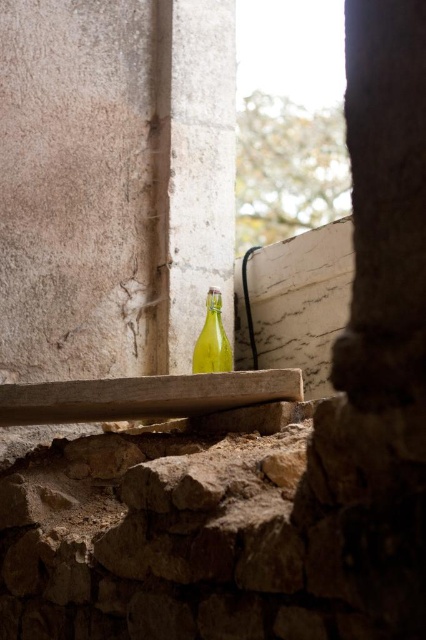
Which is below, smooth wooden plank at center or green glass bottle at center?

smooth wooden plank at center is below.

Is smooth wooden plank at center bigger than green glass bottle at center?

Correct, smooth wooden plank at center is larger in size than green glass bottle at center.

Between point (221, 404) and point (215, 332), which one is positioned in front?

Point (221, 404)

The height and width of the screenshot is (640, 426). Find the location of `smooth wooden plank at center`. smooth wooden plank at center is located at coordinates (143, 396).